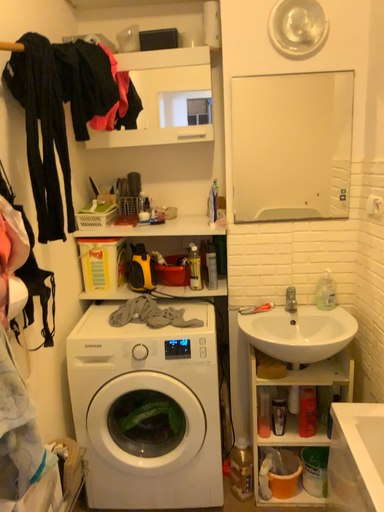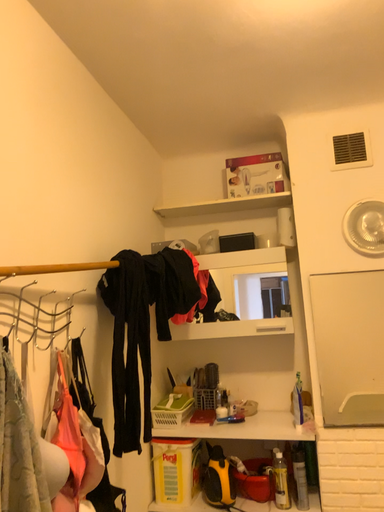
Question: How did the camera likely rotate when shooting the video?

Choices:
 (A) rotated downward
 (B) rotated upward

Answer: (B)